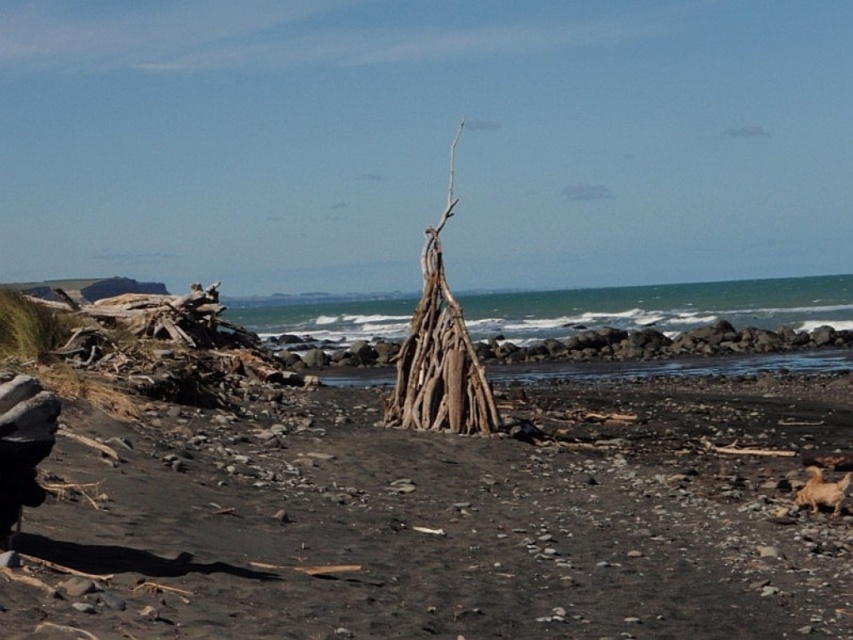
You are a photographer planning to capture the brown driftwood structure at center and the dark sand at center in a single shot. Which object will appear taller in the photograph?

The brown driftwood structure at center will appear taller in the photograph since it is taller than the dark sand at center.

You are standing at the center of the beach and see two points marked on the ground. One is at point (486, 480) and the other at point (560, 339). Which point is closer to you?

Point (486, 480) is closer to the viewer than point (560, 339).